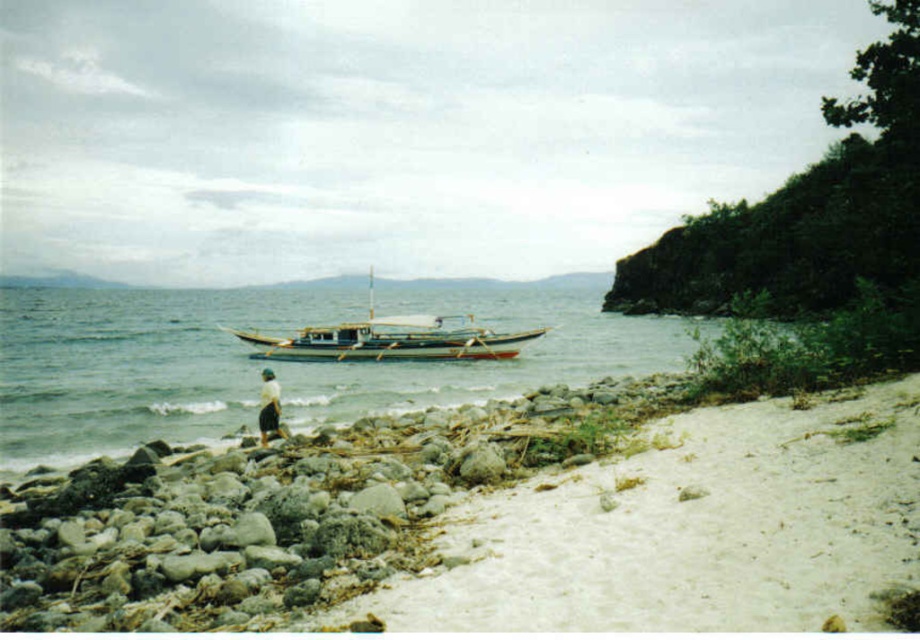
A person is standing at point A and wants to walk to point B. The coordinates of point A are point A at (167, 532) and point B is at point B at 0.183, 0.834. Given that the person can walk 1.5 meters per second, how long will it take them to reach point B?

The distance between point A at (167, 532) and point B at 0.183, 0.834 is 11.17 meters. At a walking speed of 1.5 meters per second, the time required is approximately 7.45 seconds.

You are standing at the shoreline and see two points marked in the image. The first point is at coordinates point (616, 460) and the second is at point (214, 509). Which point is closer to you?

Point (616, 460) is closer to you because it is further to the viewer than point (214, 509).

You are a photographer standing on the white sandy beach at lower right and want to take a photo of the smooth gray rocks at lower left. If your camera has a maximum focus range of 4 meters, will you be able to capture the rocks clearly without moving closer?

The white sandy beach at lower right is 3.76 meters from the smooth gray rocks at lower left. Since the distance is within the camera maximum focus range of 4 meters, you can capture the rocks clearly without moving closer.